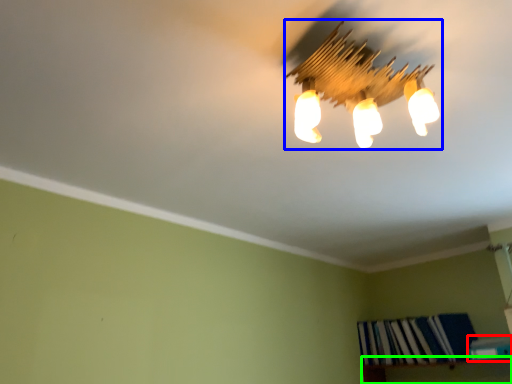
Question: Estimate the real-world distances between objects in this image. Which object is closer to book (highlighted by a red box), lamp (highlighted by a blue box) or shelf (highlighted by a green box)?

Choices:
 (A) lamp
 (B) shelf

Answer: (B)